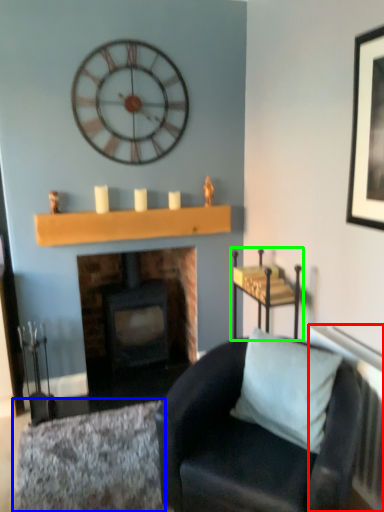
Question: Based on their relative distances, which object is farther from radiator (highlighted by a red box)? Choose from plain (highlighted by a blue box) and furniture (highlighted by a green box).

Choices:
 (A) plain
 (B) furniture

Answer: (A)